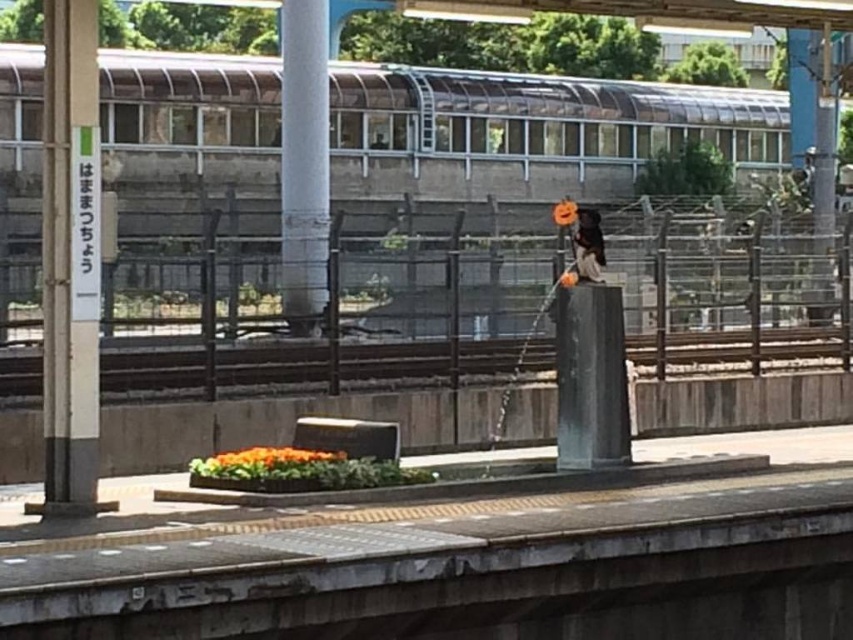
Question: Among these objects, which one is nearest to the camera?

Choices:
 (A) white painted metal pole at left
 (B) black polished stone pillar at center
 (C) smooth concrete pole at center
 (D) metallic silver train at upper center

Answer: (A)

Question: Estimate the real-world distances between objects in this image. Which object is farther from the smooth concrete pole at center?

Choices:
 (A) black polished stone pillar at center
 (B) metallic silver train at upper center
 (C) white painted metal pole at left

Answer: (C)

Question: From the image, what is the correct spatial relationship of white painted metal pole at left in relation to black polished stone pillar at center?

Choices:
 (A) below
 (B) above

Answer: (B)

Question: Considering the relative positions of white painted metal pole at left and smooth concrete pole at center in the image provided, where is white painted metal pole at left located with respect to smooth concrete pole at center?

Choices:
 (A) below
 (B) above

Answer: (A)

Question: Is metallic silver train at upper center behind white painted metal pole at left?

Choices:
 (A) no
 (B) yes

Answer: (B)

Question: Which point appears closest to the camera in this image?

Choices:
 (A) (54, 499)
 (B) (607, 344)

Answer: (A)